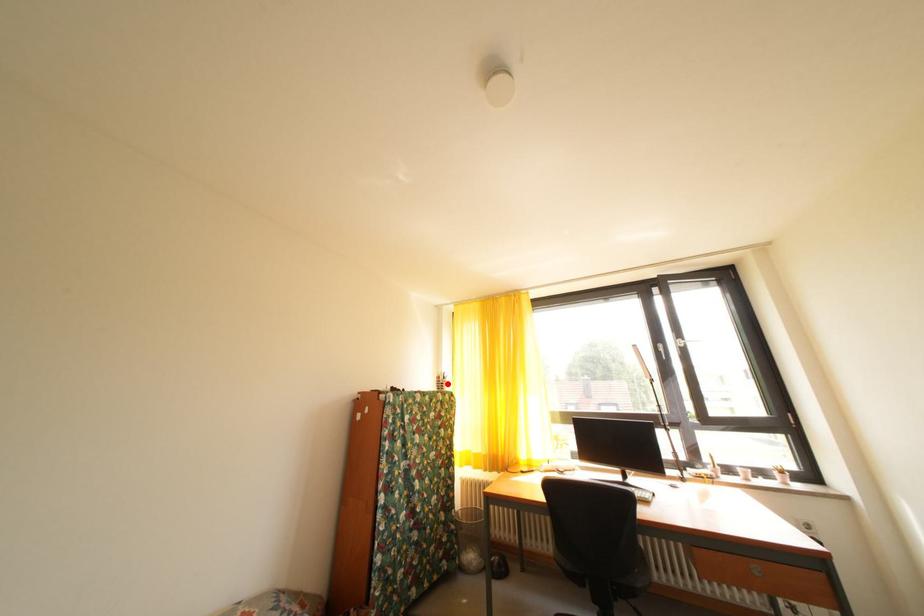
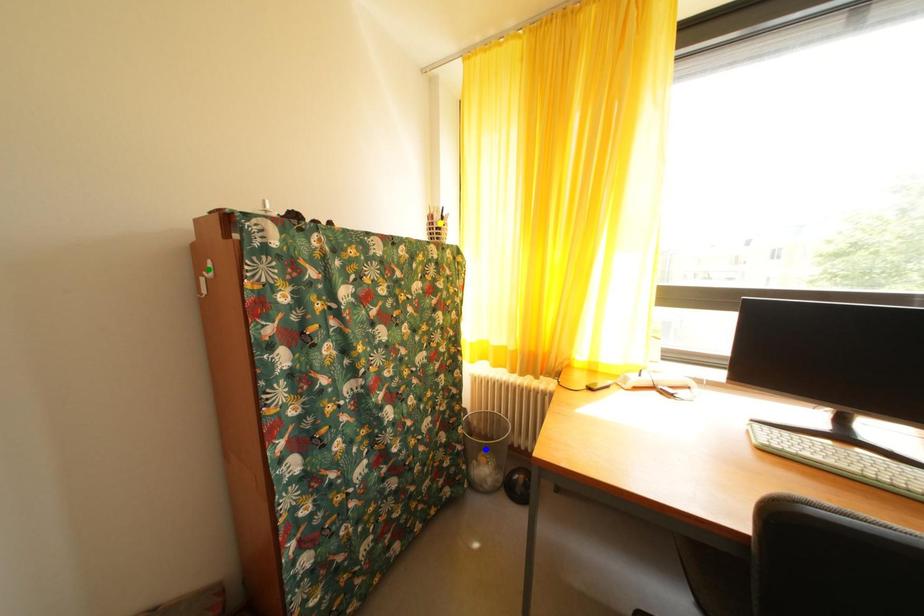
Question: I am providing you with two images of the same scene from different viewpoints. A red point is marked on the first image. You are given multiple points on the second image. Which mark in image 2 goes with the point in image 1?

Choices:
 (A) green point
 (B) yellow point
 (C) blue point

Answer: (B)